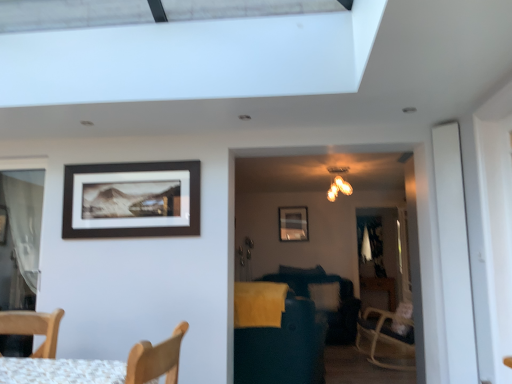
Question: Considering the relative sizes of dark blue fabric swivel chair at center and matte black picture frame at upper center, which ranks as the 1th picture frame in right-to-left order, in the image provided, is dark blue fabric swivel chair at center thinner than matte black picture frame at upper center, which ranks as the 1th picture frame in right-to-left order,?

Choices:
 (A) no
 (B) yes

Answer: (A)

Question: Is dark blue fabric swivel chair at center taller than matte black picture frame at upper center, which ranks as the 1th picture frame in right-to-left order?

Choices:
 (A) no
 (B) yes

Answer: (B)

Question: Is dark blue fabric swivel chair at center outside of matte black picture frame at upper center, which ranks as the first picture frame in bottom-to-top order?

Choices:
 (A) yes
 (B) no

Answer: (A)

Question: Considering the relative positions of dark blue fabric swivel chair at center and matte black picture frame at upper center, positioned as the 1th picture frame in back-to-front order, in the image provided, is dark blue fabric swivel chair at center to the right of matte black picture frame at upper center, positioned as the 1th picture frame in back-to-front order, from the viewer's perspective?

Choices:
 (A) no
 (B) yes

Answer: (A)

Question: From a real-world perspective, is dark blue fabric swivel chair at center located higher than matte black picture frame at upper center, which is counted as the 2th picture frame, starting from the top?

Choices:
 (A) yes
 (B) no

Answer: (B)

Question: In the image, is matte black picture frame at upper center, which is the 2th picture frame from back to front, positioned in front of or behind matte black picture frame at upper center, which ranks as the 1th picture frame in right-to-left order?

Choices:
 (A) behind
 (B) front

Answer: (B)

Question: From a real-world perspective, relative to matte black picture frame at upper center, placed as the 2th picture frame when sorted from left to right, is matte black picture frame at upper center, which is the 2th picture frame from right to left, vertically above or below?

Choices:
 (A) below
 (B) above

Answer: (A)

Question: In terms of width, does matte black picture frame at upper center, which is the 2th picture frame in bottom-to-top order, look wider or thinner when compared to matte black picture frame at upper center, which is counted as the 2th picture frame, starting from the top?

Choices:
 (A) wide
 (B) thin

Answer: (B)

Question: Considering the positions of point (184, 165) and point (290, 228), is point (184, 165) closer or farther from the camera than point (290, 228)?

Choices:
 (A) closer
 (B) farther

Answer: (A)

Question: From a real-world perspective, is matte gold chandelier at upper center positioned above or below dark blue fabric swivel chair at center?

Choices:
 (A) below
 (B) above

Answer: (B)

Question: Do you think matte gold chandelier at upper center is within dark blue fabric swivel chair at center, or outside of it?

Choices:
 (A) inside
 (B) outside

Answer: (B)

Question: From the image's perspective, relative to dark blue fabric swivel chair at center, is matte gold chandelier at upper center above or below?

Choices:
 (A) above
 (B) below

Answer: (A)

Question: Considering the positions of matte gold chandelier at upper center and dark blue fabric swivel chair at center in the image, is matte gold chandelier at upper center taller or shorter than dark blue fabric swivel chair at center?

Choices:
 (A) short
 (B) tall

Answer: (A)

Question: Do you think white glossy screen door at right is within matte black picture frame at upper center, which is the 2th picture frame from back to front, or outside of it?

Choices:
 (A) inside
 (B) outside

Answer: (B)

Question: Is point (457, 377) positioned closer to the camera than point (117, 208)?

Choices:
 (A) farther
 (B) closer

Answer: (B)